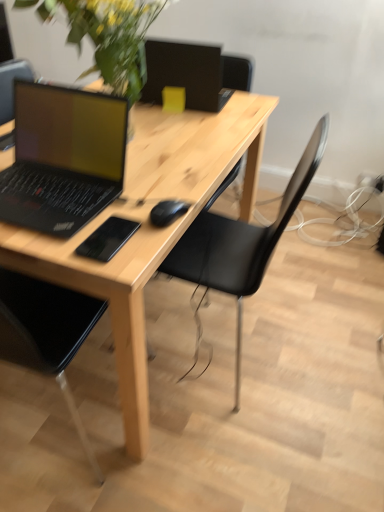
At what (x,y) coordinates should I click in order to perform the action: click on free space above natural wood desk at center (from a real-world perspective). Please return your answer as a coordinate pair (x, y). Looking at the image, I should click on (142, 146).